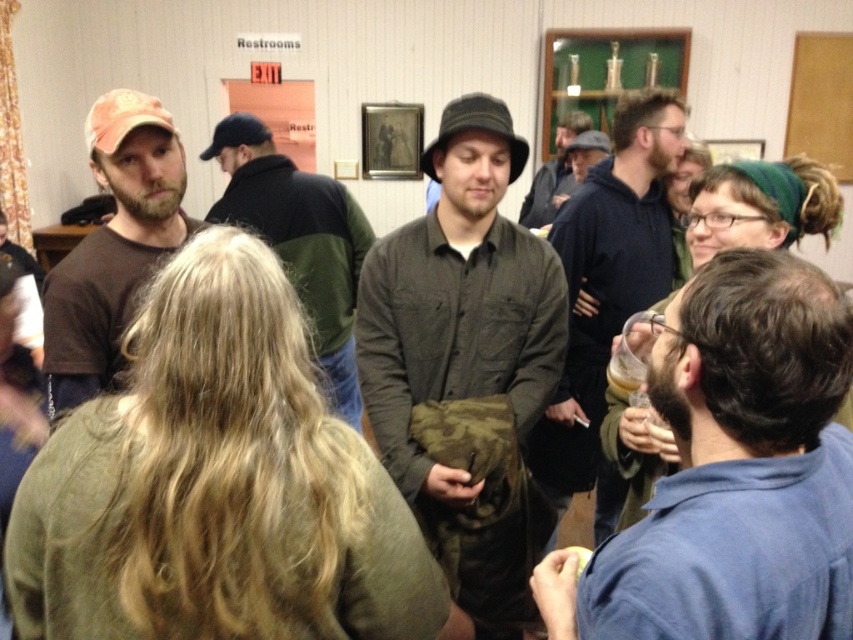
Question: Does matte black jacket at center appear under dark gray shirt at center?

Choices:
 (A) no
 (B) yes

Answer: (B)

Question: Which point is closer to the camera?

Choices:
 (A) dark gray shirt at center
 (B) dark gray cotton shirt at center
 (C) blonde hair at center
 (D) matte brown shirt at left

Answer: (C)

Question: Among these objects, which one is nearest to the camera?

Choices:
 (A) blonde hair at center
 (B) blue shirt at right
 (C) matte black jacket at center
 (D) dark gray shirt at center

Answer: (B)

Question: Which of the following is the farthest from the observer?

Choices:
 (A) (573, 182)
 (B) (140, 268)

Answer: (A)

Question: Is the position of blonde hair at center more distant than that of blue shirt at right?

Choices:
 (A) yes
 (B) no

Answer: (A)

Question: Is the position of blue shirt at right more distant than that of matte brown shirt at left?

Choices:
 (A) yes
 (B) no

Answer: (B)